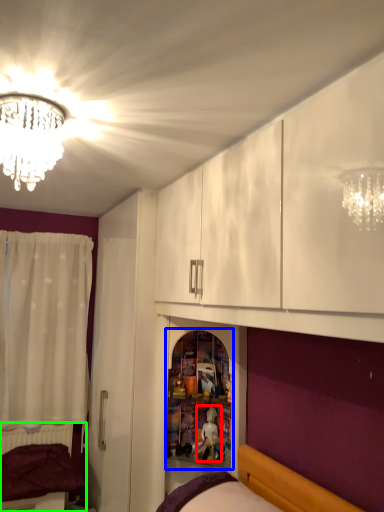
Question: Which object is the closest to the toy (highlighted by a red box)? Choose among these: shelf (highlighted by a blue box) or bed (highlighted by a green box).

Choices:
 (A) shelf
 (B) bed

Answer: (A)